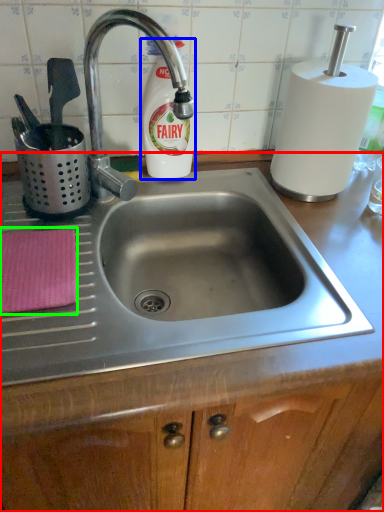
Question: Based on their relative distances, which object is nearer to counter (highlighted by a red box)? Choose from cleaning product (highlighted by a blue box) and cloth (highlighted by a green box).

Choices:
 (A) cleaning product
 (B) cloth

Answer: (B)